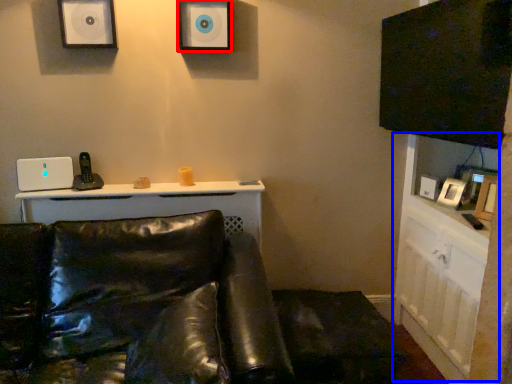
Question: Which of the following is the closest to the observer, speaker (highlighted by a red box) or dresser (highlighted by a blue box)?

Choices:
 (A) speaker
 (B) dresser

Answer: (B)